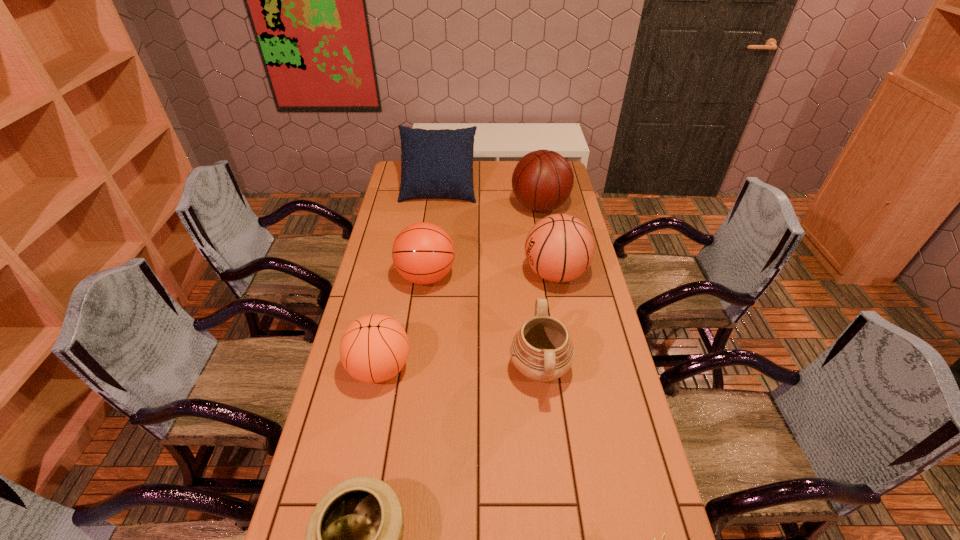
You are a GUI agent. You are given a task and a screenshot of the screen. Output one action in this format:
    pyautogui.click(x=<x>, y=<y>)
    Task: Click on the object situated at the far edge
    The width and height of the screenshot is (960, 540).
    Given the screenshot: What is the action you would take?
    pyautogui.click(x=434, y=163)

At what (x,y) coordinates should I click in order to perform the action: click on cushion that is at the left edge. Please return your answer as a coordinate pair (x, y). Image resolution: width=960 pixels, height=540 pixels. Looking at the image, I should click on (434, 163).

Identify the location of urn situated at the right edge. Image resolution: width=960 pixels, height=540 pixels. (541, 350).

At what (x,y) coordinates should I click in order to perform the action: click on object that is at the far left corner. Please return your answer as a coordinate pair (x, y). This screenshot has height=540, width=960. Looking at the image, I should click on 434,163.

Where is `vacant area at the far edge`? Image resolution: width=960 pixels, height=540 pixels. vacant area at the far edge is located at coordinates pos(496,168).

This screenshot has height=540, width=960. I want to click on free space at the left edge of the desktop, so click(x=411, y=209).

This screenshot has height=540, width=960. What are the coordinates of `free location at the right edge of the desktop` in the screenshot? It's located at (566, 205).

I want to click on free space between the cushion and the urn, so click(x=490, y=279).

You are a GUI agent. You are given a task and a screenshot of the screen. Output one action in this format:
    pyautogui.click(x=<x>, y=<y>)
    Task: Click on the vacant area between the cushion and the farthest basketball
    Image resolution: width=960 pixels, height=540 pixels.
    Given the screenshot: What is the action you would take?
    pyautogui.click(x=490, y=198)

The image size is (960, 540). Identify the location of free spot between the urn and the nearest basketball. (460, 368).